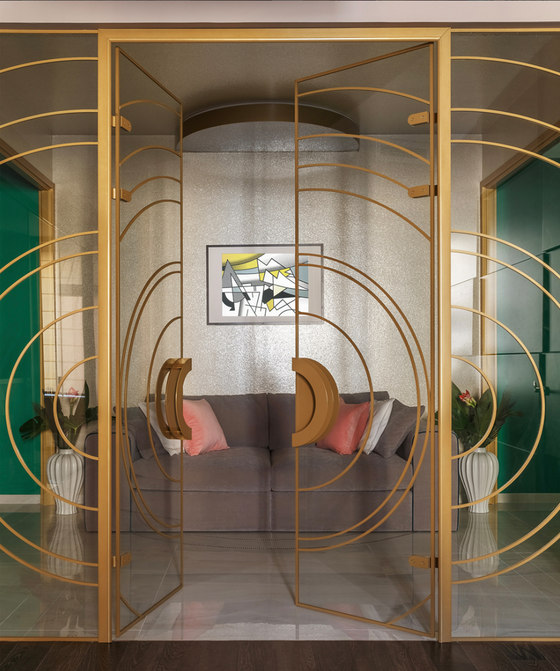
The image size is (560, 671). I want to click on door handles, so click(176, 401), click(320, 396).